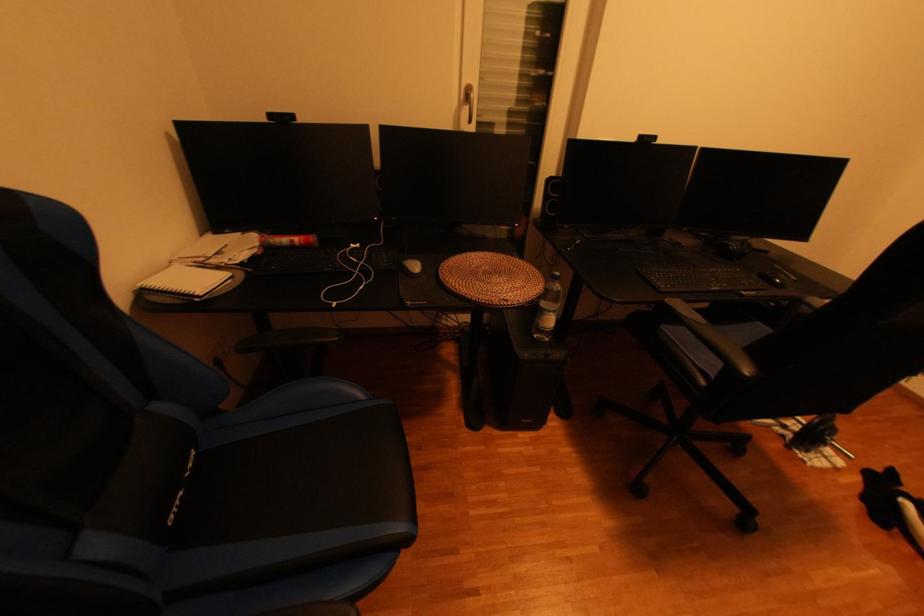
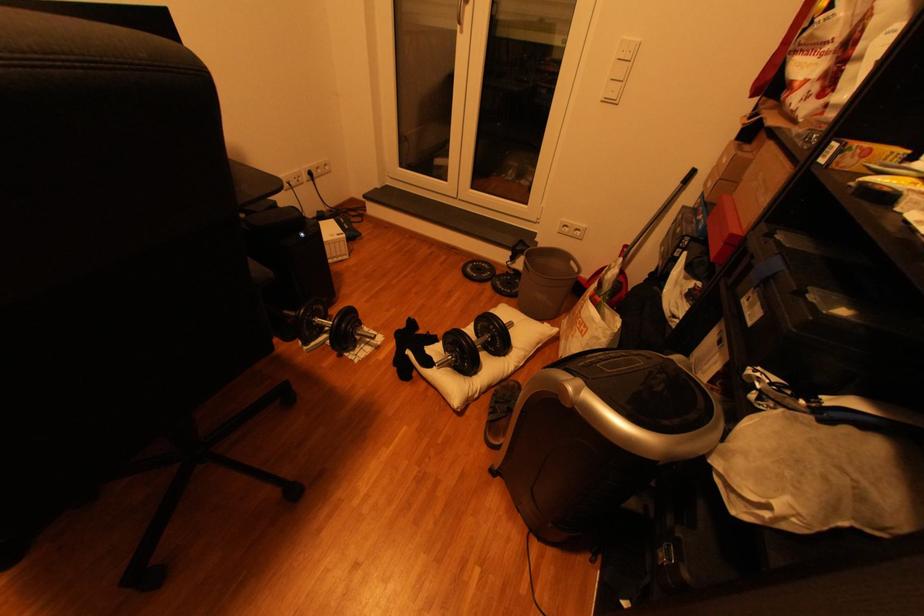
The point at (831, 427) is marked in the first image. Where is the corresponding point in the second image?

(354, 326)